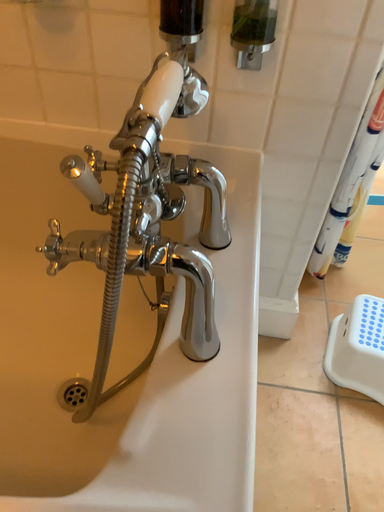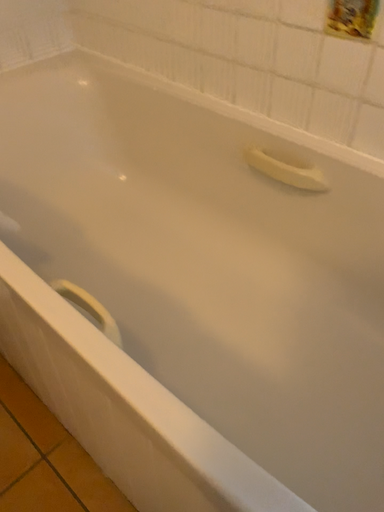
Question: How did the camera likely rotate when shooting the video?

Choices:
 (A) rotated left
 (B) rotated right

Answer: (A)